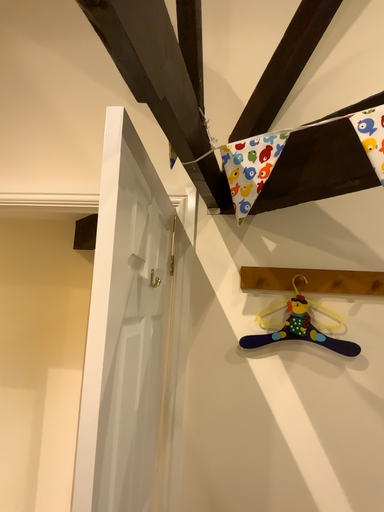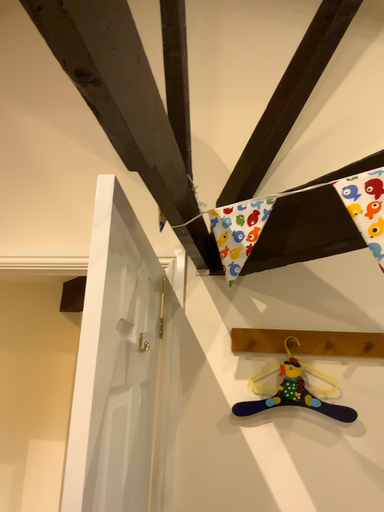
Question: Which way did the camera rotate in the video?

Choices:
 (A) rotated upward
 (B) rotated downward

Answer: (A)